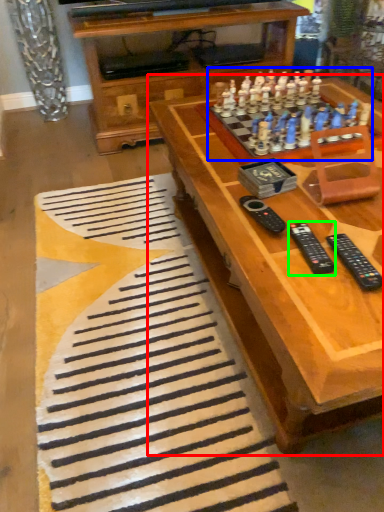
Question: Considering the real-world distances, which object is closest to table (highlighted by a red box)? game (highlighted by a blue box) or remote (highlighted by a green box).

Choices:
 (A) game
 (B) remote

Answer: (A)